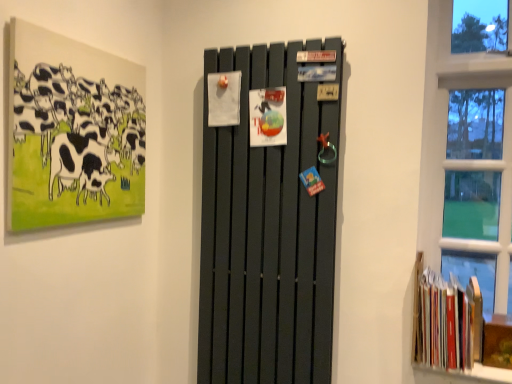
Image resolution: width=512 pixels, height=384 pixels. Describe the element at coordinates (72, 132) in the screenshot. I see `matte black painting of cows at upper left` at that location.

The width and height of the screenshot is (512, 384). In order to click on hardcover books at lower right in this screenshot , I will do `click(444, 323)`.

This screenshot has height=384, width=512. I want to click on matte black painting of cows at upper left, so click(72, 132).

Does matte black radiator at center have a greater height compared to hardcover books at lower right?

Correct, matte black radiator at center is much taller as hardcover books at lower right.

Between matte black radiator at center and hardcover books at lower right, which one has larger width?

With larger width is hardcover books at lower right.

From the image's perspective, which one is positioned higher, matte black radiator at center or hardcover books at lower right?

matte black radiator at center is shown above in the image.

What are the coordinates of `barn door above the hardcover books at lower right (from the image's perspective)` in the screenshot? It's located at (268, 231).

How different are the orientations of hardcover books at lower right and matte black painting of cows at upper left in degrees?

hardcover books at lower right and matte black painting of cows at upper left are facing 89.4 degrees away from each other.

Considering the positions of objects hardcover books at lower right and matte black painting of cows at upper left in the image provided, who is more to the left, hardcover books at lower right or matte black painting of cows at upper left?

Positioned to the left is matte black painting of cows at upper left.

From the image's perspective, is hardcover books at lower right located above matte black painting of cows at upper left?

Incorrect, from the image's perspective, hardcover books at lower right is lower than matte black painting of cows at upper left.

From a real-world perspective, is matte black painting of cows at upper left under hardcover books at lower right?

No, from a real-world perspective, matte black painting of cows at upper left is not below hardcover books at lower right.

Does point (78, 83) come farther from viewer compared to point (437, 284)?

That is False.

From the image's perspective, would you say matte black painting of cows at upper left is shown under hardcover books at lower right?

Actually, matte black painting of cows at upper left appears above hardcover books at lower right in the image.

Can you confirm if matte black painting of cows at upper left is shorter than hardcover books at lower right?

Incorrect, the height of matte black painting of cows at upper left does not fall short of that of hardcover books at lower right.

Could you tell me if matte black radiator at center is turned towards matte black painting of cows at upper left?

No, matte black radiator at center is not aimed at matte black painting of cows at upper left.

From a real-world perspective, does matte black radiator at center sit lower than matte black painting of cows at upper left?

Yes, from a real-world perspective, matte black radiator at center is under matte black painting of cows at upper left.

Which object is wider, matte black radiator at center or matte black painting of cows at upper left?

matte black radiator at center is wider.

Does matte black radiator at center have a greater height compared to matte black painting of cows at upper left?

Correct, matte black radiator at center is much taller as matte black painting of cows at upper left.

Between point (61, 97) and point (279, 48), which one is positioned in front?

Point (61, 97)

Does matte black painting of cows at upper left touch matte black radiator at center?

No, matte black painting of cows at upper left is not in contact with matte black radiator at center.

From a real-world perspective, which is physically below, matte black painting of cows at upper left or matte black radiator at center?

matte black radiator at center is physically lower.

Is hardcover books at lower right taller than matte black radiator at center?

Incorrect, the height of hardcover books at lower right is not larger of that of matte black radiator at center.

Based on the photo, measure the distance from hardcover books at lower right to matte black radiator at center.

hardcover books at lower right is 54.73 centimeters from matte black radiator at center.

From a real-world perspective, which object rests below the other?

hardcover books at lower right, from a real-world perspective.

Is hardcover books at lower right looking in the opposite direction of matte black radiator at center?

No, matte black radiator at center is not at the back of hardcover books at lower right.

Locate an element on the screen. The image size is (512, 384). barn door on the left of the hardcover books at lower right is located at coordinates (268, 231).

Identify the location of book below the matte black painting of cows at upper left (from a real-world perspective). (444, 323).

When comparing their distances from matte black painting of cows at upper left, does matte black radiator at center or hardcover books at lower right seem closer?

matte black radiator at center lies closer to matte black painting of cows at upper left than the other object.

Based on their spatial positions, is matte black painting of cows at upper left or hardcover books at lower right closer to matte black radiator at center?

hardcover books at lower right.

Estimate the real-world distances between objects in this image. Which object is further from matte black radiator at center, hardcover books at lower right or matte black painting of cows at upper left?

The object further to matte black radiator at center is matte black painting of cows at upper left.

When comparing their distances from hardcover books at lower right, does matte black radiator at center or matte black painting of cows at upper left seem closer?

matte black radiator at center is positioned closer to the anchor hardcover books at lower right.

Estimate the real-world distances between objects in this image. Which object is further from matte black painting of cows at upper left, hardcover books at lower right or matte black radiator at center?

hardcover books at lower right is positioned further to the anchor matte black painting of cows at upper left.

Consider the image. From the image, which object appears to be farther from hardcover books at lower right, matte black painting of cows at upper left or matte black radiator at center?

matte black painting of cows at upper left.

Where is `barn door situated between matte black painting of cows at upper left and hardcover books at lower right from left to right`? barn door situated between matte black painting of cows at upper left and hardcover books at lower right from left to right is located at coordinates (268, 231).